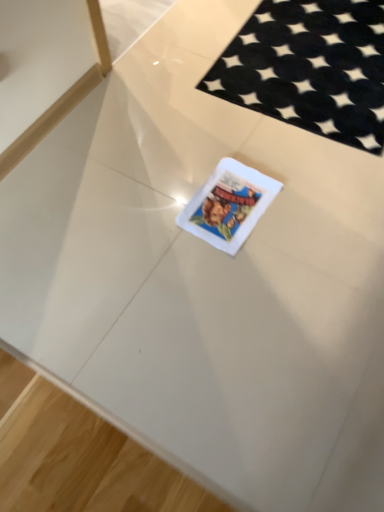
Question: From a real-world perspective, relative to white matte card at center, is black felt mat at upper right vertically above or below?

Choices:
 (A) above
 (B) below

Answer: (B)

Question: Considering the positions of point (306, 79) and point (220, 172), is point (306, 79) closer or farther from the camera than point (220, 172)?

Choices:
 (A) farther
 (B) closer

Answer: (A)

Question: Is black felt mat at upper right taller or shorter than white matte card at center?

Choices:
 (A) short
 (B) tall

Answer: (A)

Question: Based on their positions, is white matte card at center located to the left or right of black felt mat at upper right?

Choices:
 (A) right
 (B) left

Answer: (B)

Question: In terms of height, does white matte card at center look taller or shorter compared to black felt mat at upper right?

Choices:
 (A) tall
 (B) short

Answer: (A)

Question: Considering the positions of white matte card at center and black felt mat at upper right in the image, is white matte card at center wider or thinner than black felt mat at upper right?

Choices:
 (A) wide
 (B) thin

Answer: (B)

Question: From a real-world perspective, is white matte card at center physically located above or below black felt mat at upper right?

Choices:
 (A) below
 (B) above

Answer: (B)